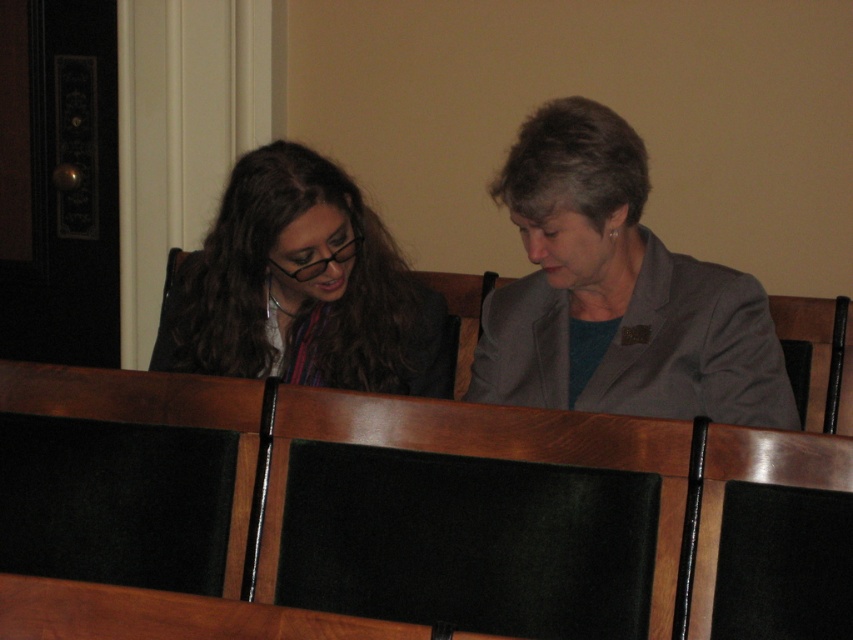
Question: Which object is the farthest from the black leather chair at right?

Choices:
 (A) black fabric chair at center
 (B) black leather chair at lower left
 (C) black leather chair at center
 (D) wooden table at center

Answer: (D)

Question: Does matte black hair at left appear over black leather chair at right?

Choices:
 (A) no
 (B) yes

Answer: (B)

Question: Is black leather chair at lower left bigger than wooden table at center?

Choices:
 (A) no
 (B) yes

Answer: (B)

Question: Which point is farther from the camera taking this photo?

Choices:
 (A) (195, 417)
 (B) (751, 460)

Answer: (A)

Question: Does black leather chair at lower left appear under black leather chair at lower right?

Choices:
 (A) no
 (B) yes

Answer: (A)

Question: Which point is closer to the camera?

Choices:
 (A) gray fabric jacket at center
 (B) matte black hair at left
 (C) black leather chair at lower right
 (D) wooden table at center

Answer: (D)